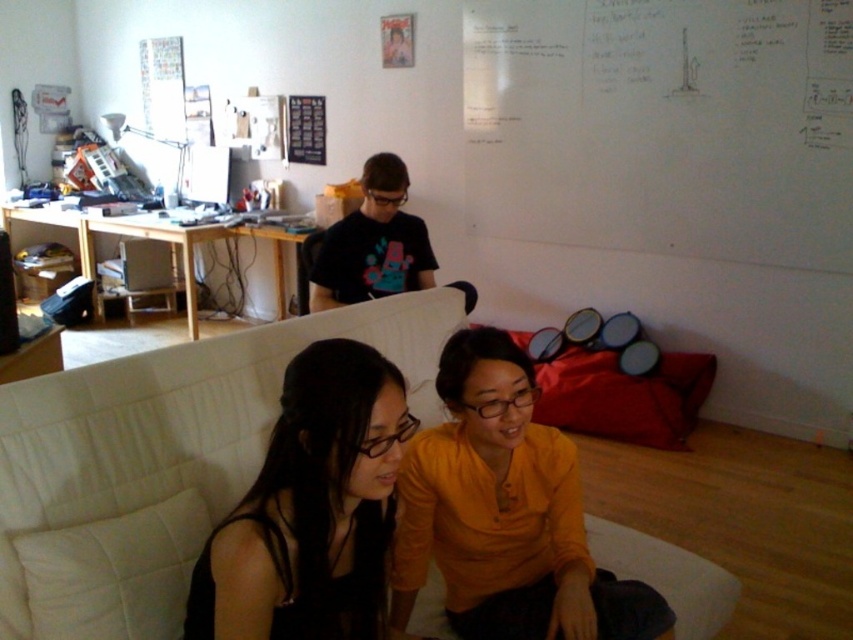
The image size is (853, 640). What do you see at coordinates (312, 509) in the screenshot?
I see `black matte hair at lower left` at bounding box center [312, 509].

Where is `black matte hair at lower left`? The width and height of the screenshot is (853, 640). black matte hair at lower left is located at coordinates (312, 509).

Is white paperboard at upper right shorter than black matte t-shirt at upper center?

Incorrect, white paperboard at upper right's height does not fall short of black matte t-shirt at upper center's.

Which of these two, white paperboard at upper right or black matte t-shirt at upper center, stands shorter?

With less height is black matte t-shirt at upper center.

Which is behind, point (782, 195) or point (380, 230)?

Positioned behind is point (782, 195).

I want to click on white paperboard at upper right, so click(663, 125).

Based on the photo, can you confirm if matte black shirt at center is positioned to the right of black matte t-shirt at upper center?

Indeed, matte black shirt at center is positioned on the right side of black matte t-shirt at upper center.

What do you see at coordinates (410, 512) in the screenshot? The width and height of the screenshot is (853, 640). I see `matte black shirt at center` at bounding box center [410, 512].

Is point (364, 588) positioned before point (347, 289)?

Yes.

Identify the location of matte black shirt at center. This screenshot has height=640, width=853. (410, 512).